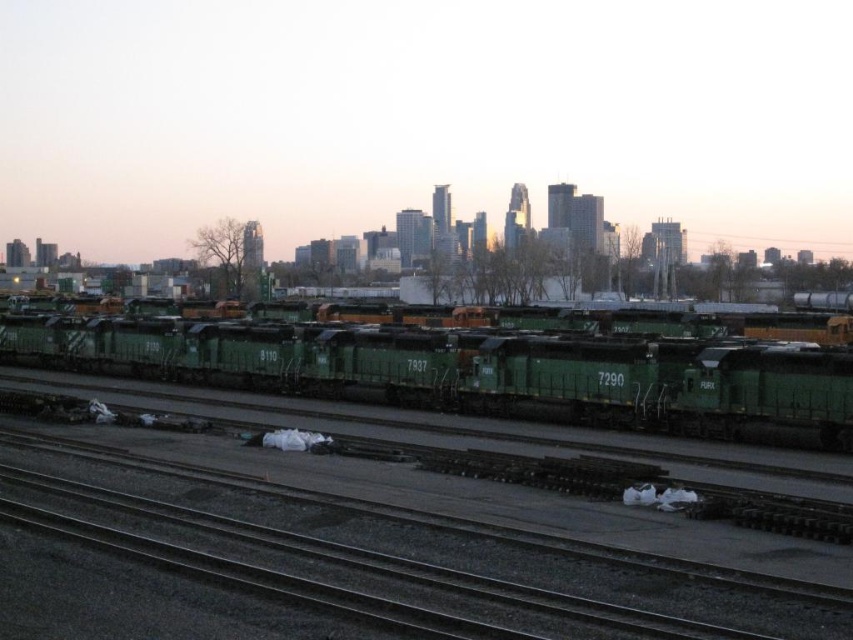
Image resolution: width=853 pixels, height=640 pixels. Describe the element at coordinates (407, 561) in the screenshot. I see `black asphalt train track at lower center` at that location.

Is point (231, 579) positioned behind point (676, 394)?

No, (231, 579) is closer to viewer.

This screenshot has height=640, width=853. Identify the location of black asphalt train track at lower center. (407, 561).